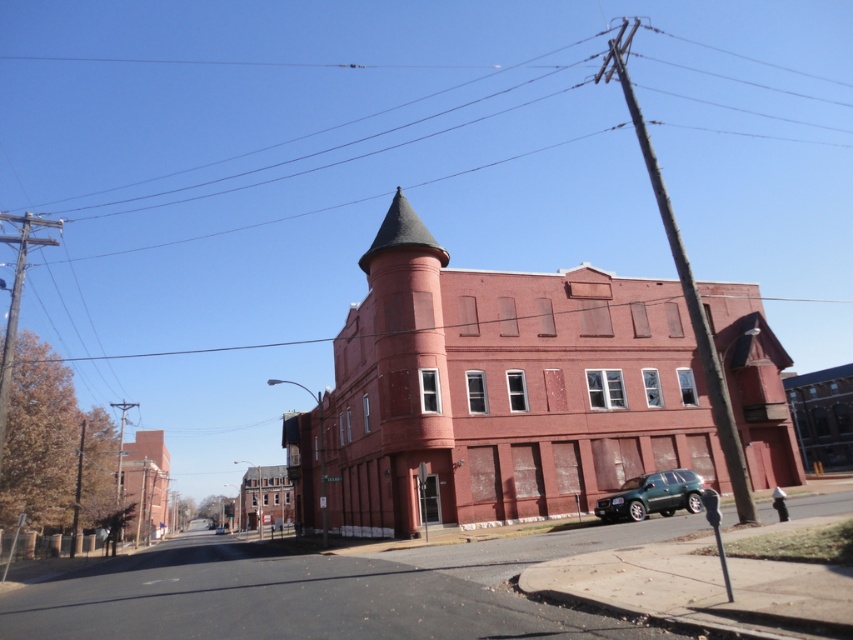
Question: Is green matte suv at lower right to the right of green metallic suv at center from the viewer's perspective?

Choices:
 (A) yes
 (B) no

Answer: (A)

Question: Is green matte suv at lower right wider than green metallic suv at center?

Choices:
 (A) no
 (B) yes

Answer: (A)

Question: Does green matte suv at lower right appear under green metallic suv at center?

Choices:
 (A) no
 (B) yes

Answer: (A)